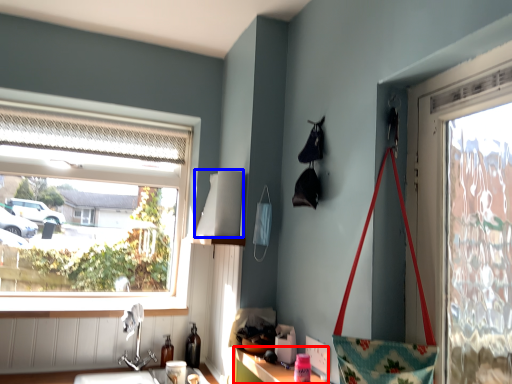
Question: Which object is closer to the camera taking this photo, cabinetry (highlighted by a red box) or lampshade (highlighted by a blue box)?

Choices:
 (A) cabinetry
 (B) lampshade

Answer: (A)